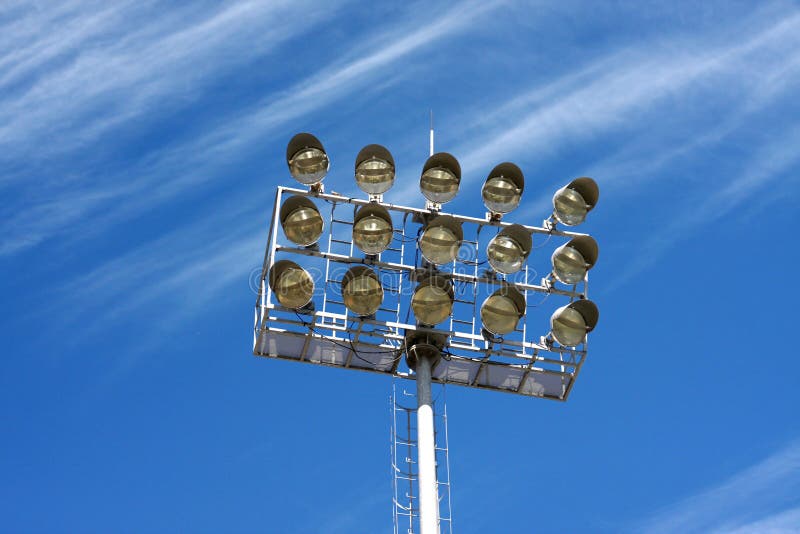
Locate an element on the screen. other light starting from the top left including the first is located at coordinates (304, 162), (434, 174), (570, 200), (366, 229), (510, 241), (293, 278), (432, 290), (572, 318).